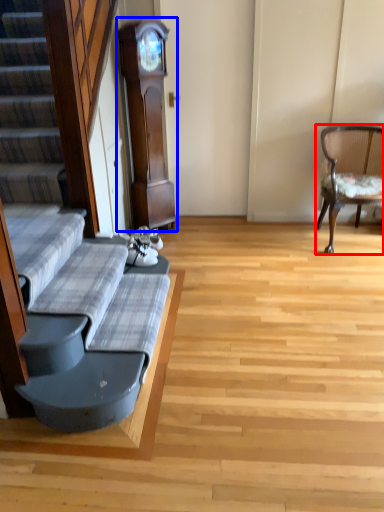
Question: Which object appears closest to the camera in this image, chair (highlighted by a red box) or cabinetry (highlighted by a blue box)?

Choices:
 (A) chair
 (B) cabinetry

Answer: (A)